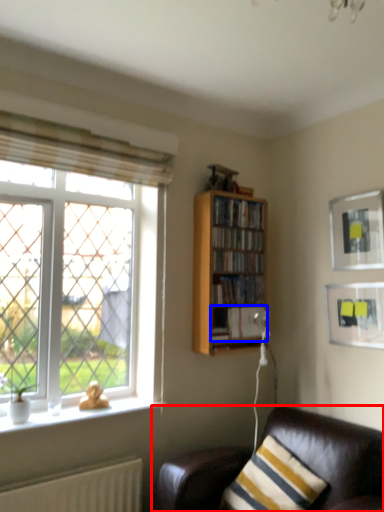
Question: Which of the following is the farthest to the observer, studio couch (highlighted by a red box) or book (highlighted by a blue box)?

Choices:
 (A) studio couch
 (B) book

Answer: (B)